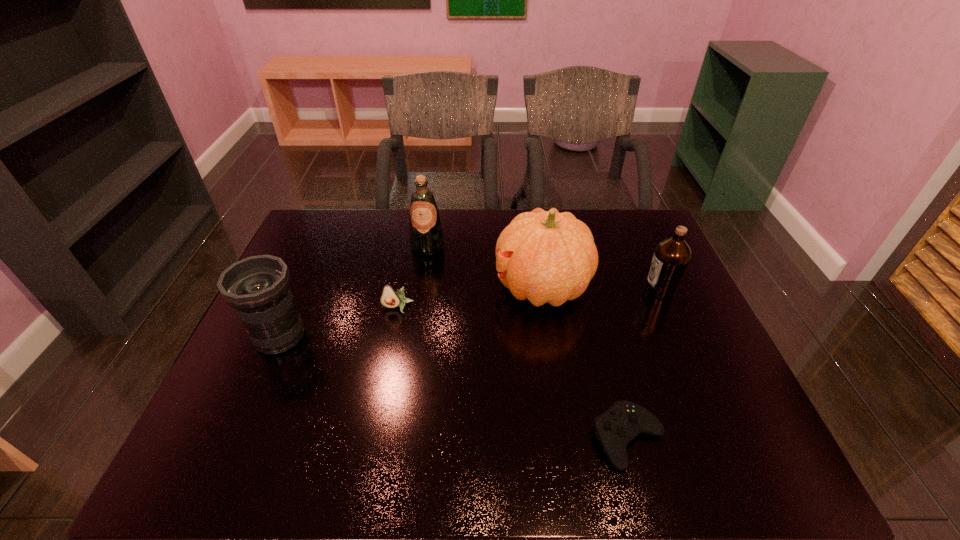
Image resolution: width=960 pixels, height=540 pixels. Identify the location of vacant area that lies between the nearer olive oil and the pumpkin. (601, 289).

The height and width of the screenshot is (540, 960). I want to click on free space between the rightmost object and the shortest object, so (644, 364).

This screenshot has width=960, height=540. What are the coordinates of `blank region between the leftmost object and the shortest object` in the screenshot? It's located at (454, 387).

Identify the location of empty space between the avocado and the control. The width and height of the screenshot is (960, 540). (513, 373).

Image resolution: width=960 pixels, height=540 pixels. In order to click on empty space between the fifth tallest object and the pumpkin in this screenshot , I will do `click(469, 298)`.

Find the location of a particular element. This screenshot has height=540, width=960. free space between the shortest object and the telephoto lens is located at coordinates (454, 387).

Find the location of a particular element. free point between the farther olive oil and the pumpkin is located at coordinates (485, 267).

The height and width of the screenshot is (540, 960). What are the coordinates of `free point between the fifth tallest object and the pumpkin` in the screenshot? It's located at (469, 298).

The height and width of the screenshot is (540, 960). Identify the location of object that stands as the fourth closest to the rightmost object. (390, 298).

The width and height of the screenshot is (960, 540). In order to click on the third closest object to the leftmost object in this screenshot , I will do `click(544, 256)`.